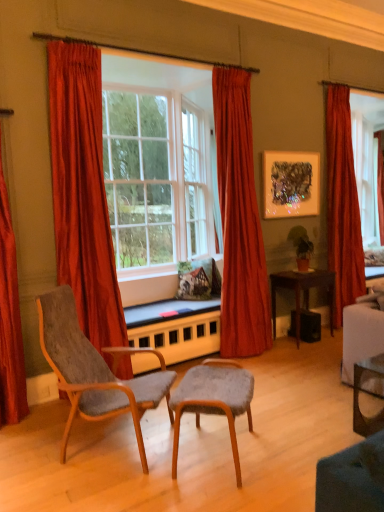
Locate an element on the screen. The width and height of the screenshot is (384, 512). vacant point above metallic textured artwork at upper right (from a real-world perspective) is located at coordinates (288, 153).